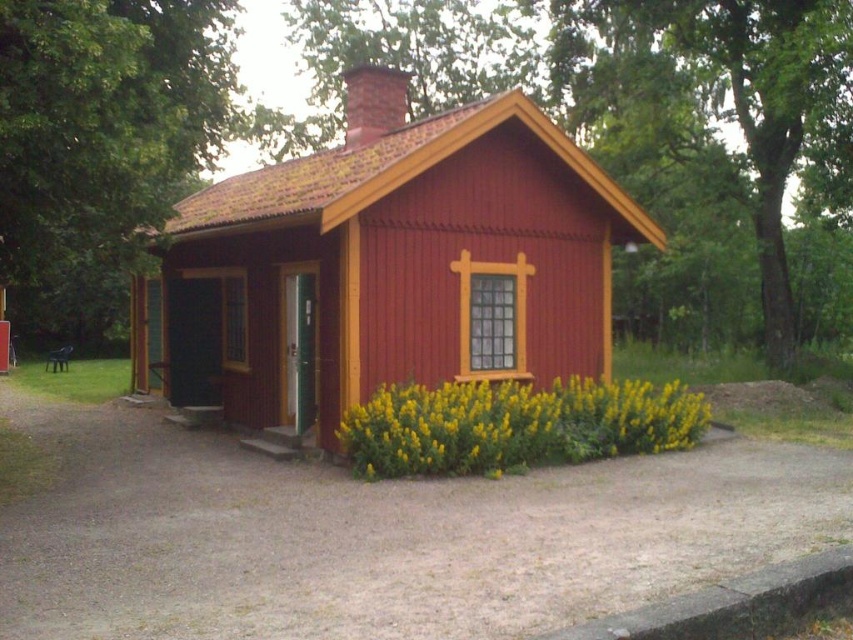
Question: Which point is closer to the camera?

Choices:
 (A) (320, 388)
 (B) (347, 412)

Answer: (B)

Question: Is matte red wooden cabin at center smaller than yellow matte flowers at lower center?

Choices:
 (A) yes
 (B) no

Answer: (B)

Question: Can you confirm if matte red wooden cabin at center is positioned to the right of yellow matte flowers at lower center?

Choices:
 (A) yes
 (B) no

Answer: (B)

Question: Which point is farther from the camera taking this photo?

Choices:
 (A) [x=463, y=212]
 (B) [x=577, y=451]

Answer: (A)

Question: Considering the relative positions of matte red wooden cabin at center and yellow matte flowers at lower center in the image provided, where is matte red wooden cabin at center located with respect to yellow matte flowers at lower center?

Choices:
 (A) left
 (B) right

Answer: (A)